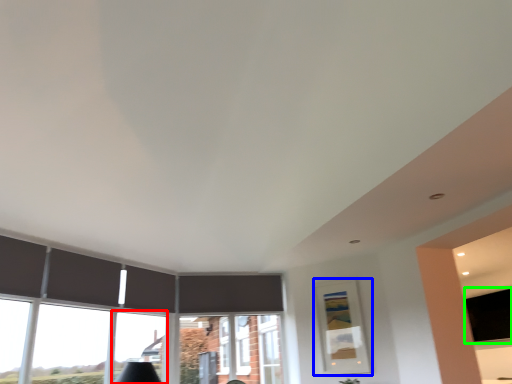
Question: Which object is positioned farthest from window (highlighted by a red box)? Select from picture frame (highlighted by a blue box) and window screen (highlighted by a green box).

Choices:
 (A) picture frame
 (B) window screen

Answer: (B)